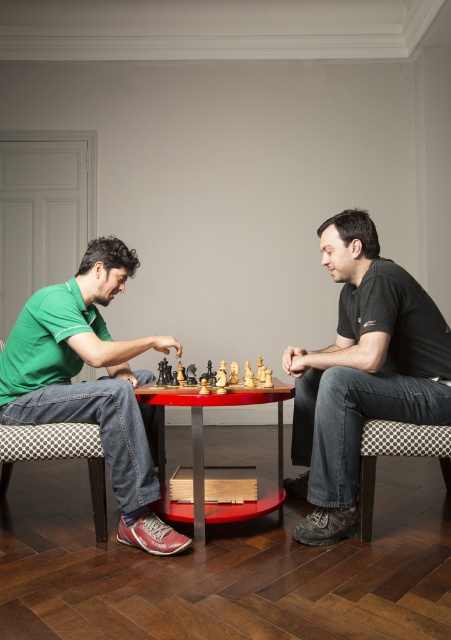
Question: Does black cotton shirt at center have a smaller size compared to green fabric shirt at left?

Choices:
 (A) yes
 (B) no

Answer: (A)

Question: Does red glossy table at center lie in front of wooden chess set at center?

Choices:
 (A) yes
 (B) no

Answer: (A)

Question: Does green fabric shirt at left have a lesser width compared to red glossy table at center?

Choices:
 (A) yes
 (B) no

Answer: (B)

Question: Among these objects, which one is farthest from the camera?

Choices:
 (A) red glossy table at center
 (B) green fabric shirt at left

Answer: (B)

Question: Which object is farther from the camera taking this photo?

Choices:
 (A) wooden chess set at center
 (B) green fabric shirt at left

Answer: (A)

Question: Which point appears farthest from the camera in this image?

Choices:
 (A) (179, 515)
 (B) (374, 262)
 (C) (122, 356)
 (D) (220, 385)

Answer: (C)